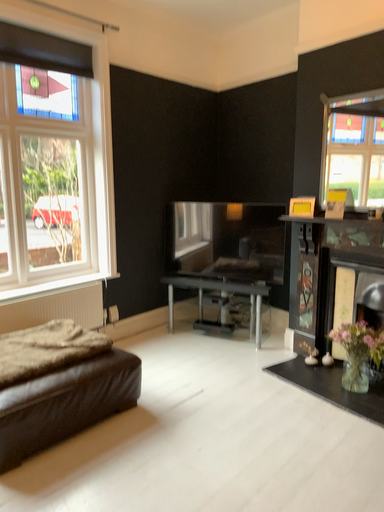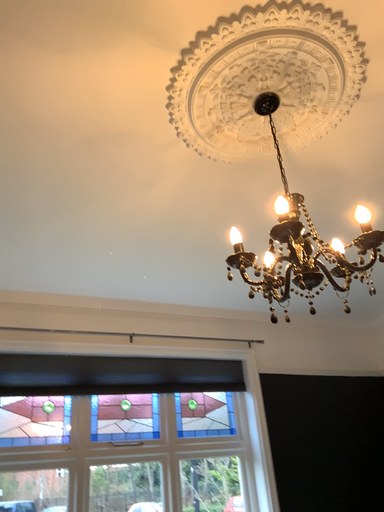
Question: How did the camera likely rotate when shooting the video?

Choices:
 (A) rotated upward
 (B) rotated downward

Answer: (A)